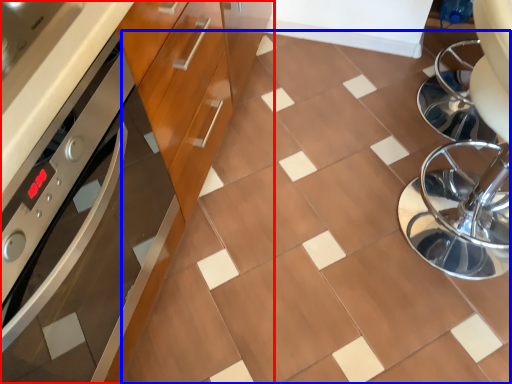
Question: Which point is closer to the camera, cabinetry (highlighted by a red box) or ceramic tile (highlighted by a blue box)?

Choices:
 (A) cabinetry
 (B) ceramic tile

Answer: (A)